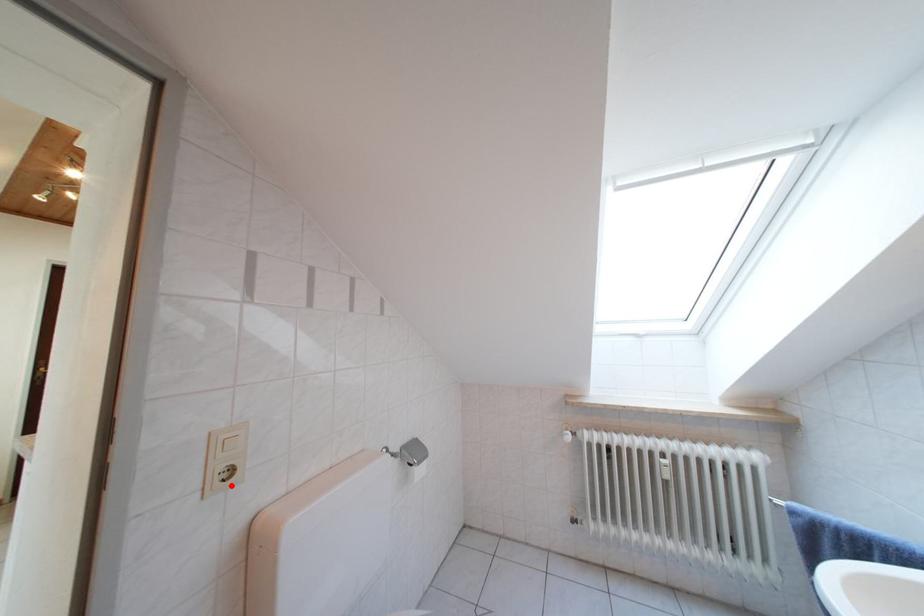
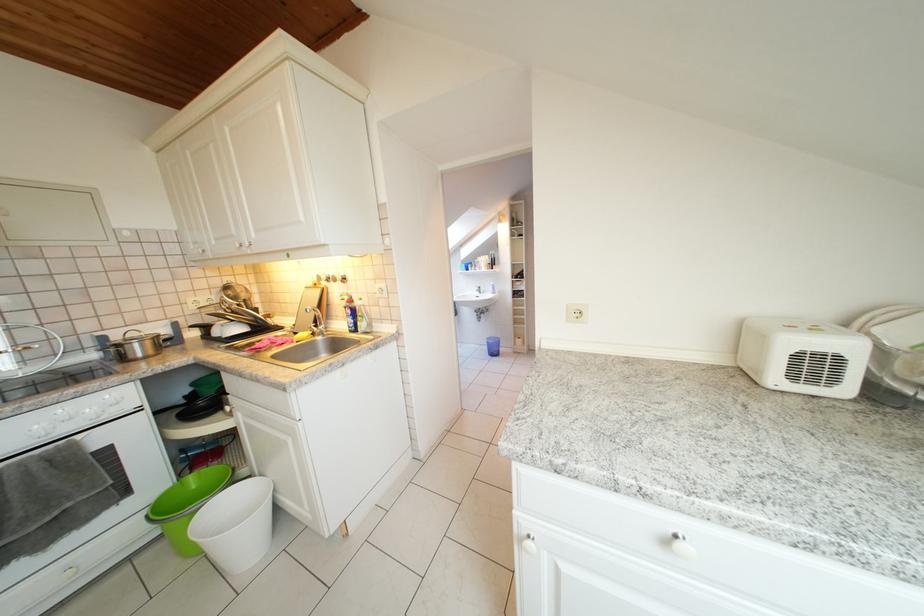
Question: I am providing you with two images of the same scene from different viewpoints. A red point is marked on the first image. At the location where the point appears in image 1, is it still visible in image 2?

Choices:
 (A) Yes
 (B) No

Answer: (B)